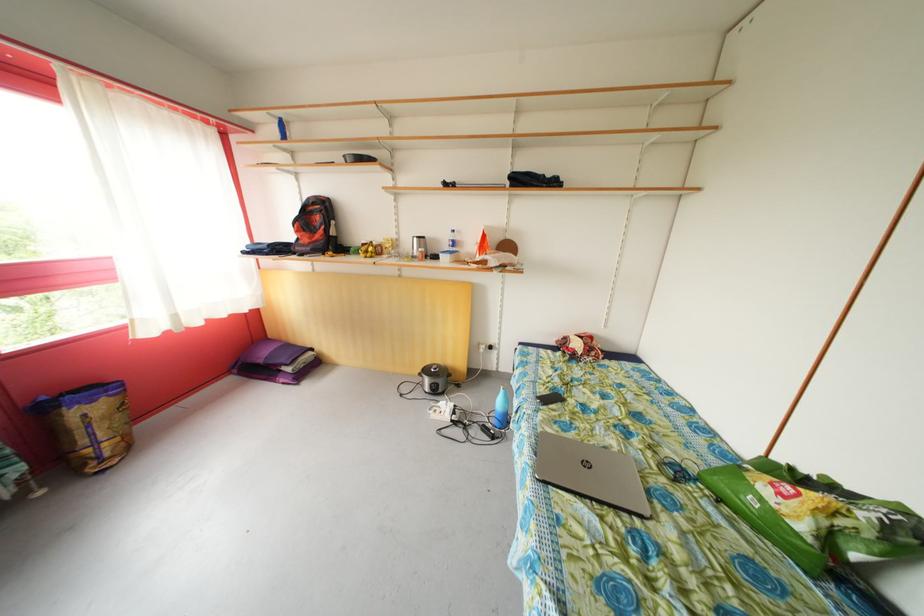
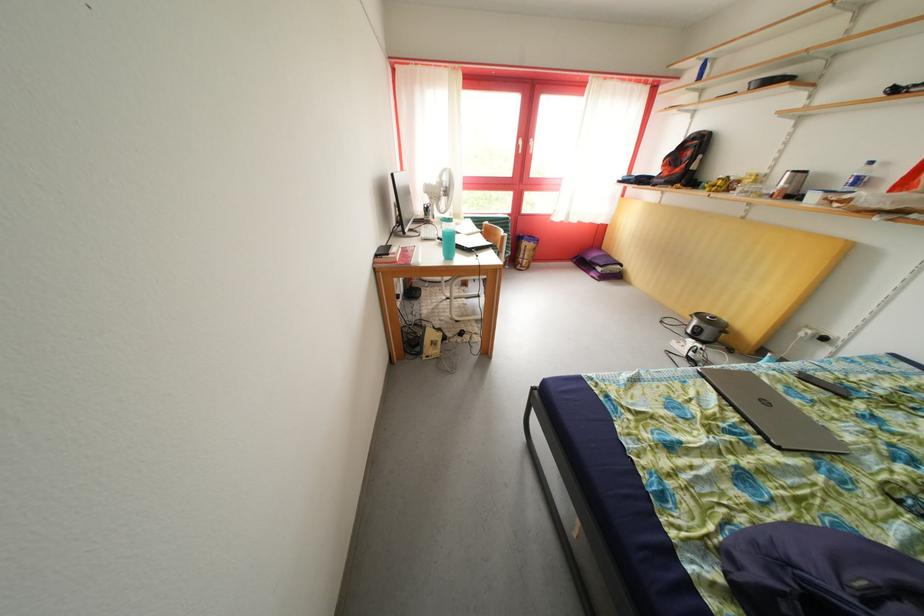
Where in the second image is the point corresponding to pixel 550 397 from the first image?

(831, 382)